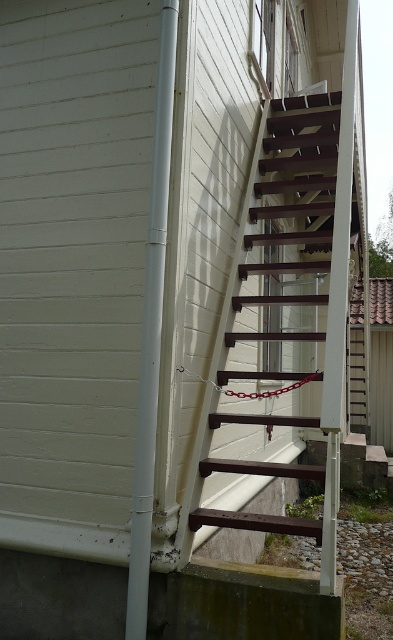
Which is more to the left, brown wooden ladder at center or white plastic pole at left?

Positioned to the left is white plastic pole at left.

Between brown wooden ladder at center and white plastic pole at left, which one has more height?

Standing taller between the two is white plastic pole at left.

Between point (337, 339) and point (139, 385), which one is positioned behind?

The point (337, 339) is more distant.

The image size is (393, 640). In order to click on brown wooden ladder at center in this screenshot , I will do `click(297, 248)`.